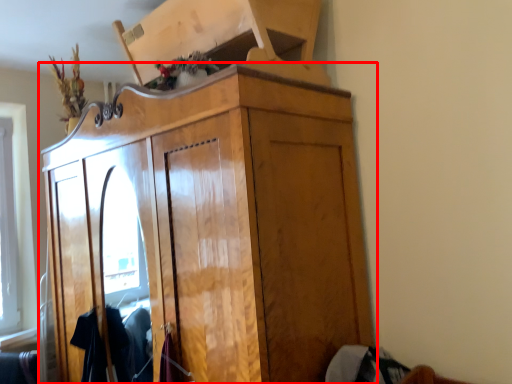
Question: In this image, where is cupboard (annotated by the red box) located relative to clothing?

Choices:
 (A) right
 (B) left

Answer: (B)